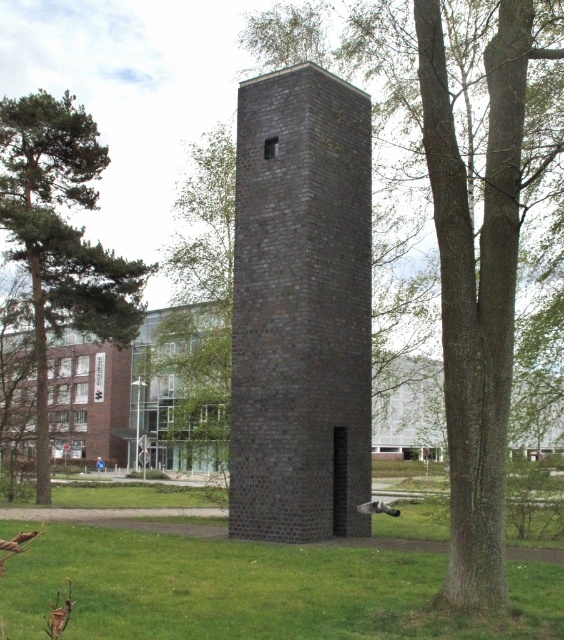
You are standing in a park and see the dark gray brick tower at center and the green grass at center. Which object is positioned more to the right from your viewpoint?

The dark gray brick tower at center is positioned more to the right than the green grass at center.

You are standing in the park and want to locate the dark gray brick tower at center. According to the map, your current position is at point 0.483, 0.534. Is the tower directly in front of you?

Yes, the dark gray brick tower at center is located exactly at your current position at point [301,308], so it is directly in front of you.

You are standing at the base of the tall brick structure and looking around. There is a point marked at coordinates (253, 589). What is located at this point?

The point at coordinates (253, 589) indicates green grass at center.